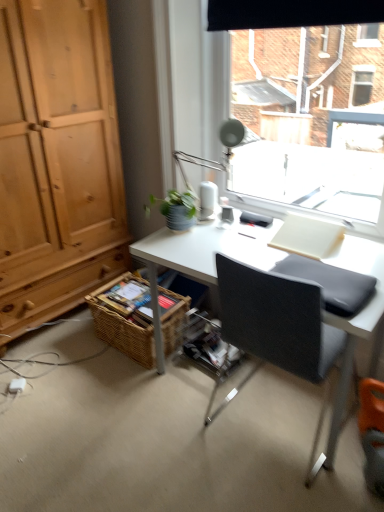
Question: From a real-world perspective, is woven brown basket at lower left positioned above or below green matte plant at upper center?

Choices:
 (A) below
 (B) above

Answer: (A)

Question: Which is correct: woven brown basket at lower left is inside green matte plant at upper center, or outside of it?

Choices:
 (A) outside
 (B) inside

Answer: (A)

Question: Estimate the real-world distances between objects in this image. Which object is closer to the green matte plant at upper center?

Choices:
 (A) matte silver table lamp at upper center
 (B) transparent glass window at upper center
 (C) black fabric chair at center
 (D) woven brown basket at lower left

Answer: (A)

Question: Based on their relative distances, which object is nearer to the matte silver table lamp at upper center?

Choices:
 (A) transparent glass window at upper center
 (B) woven brown basket at lower left
 (C) green matte plant at upper center
 (D) black fabric chair at center

Answer: (C)